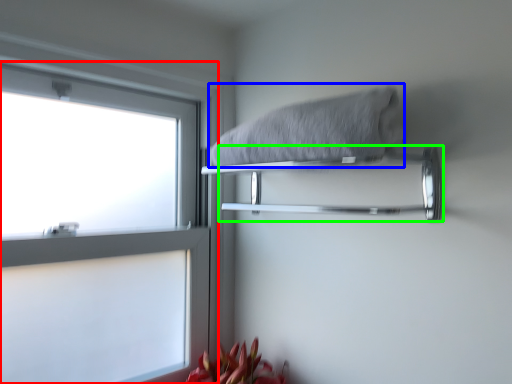
Question: Estimate the real-world distances between objects in this image. Which object is closer to window (highlighted by a red box), bath towel (highlighted by a blue box) or towel bar (highlighted by a green box)?

Choices:
 (A) bath towel
 (B) towel bar

Answer: (B)